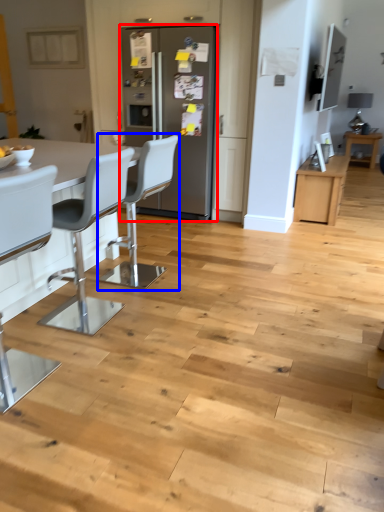
Question: Which of the following is the closest to the observer, fridge (highlighted by a red box) or chair (highlighted by a blue box)?

Choices:
 (A) fridge
 (B) chair

Answer: (B)